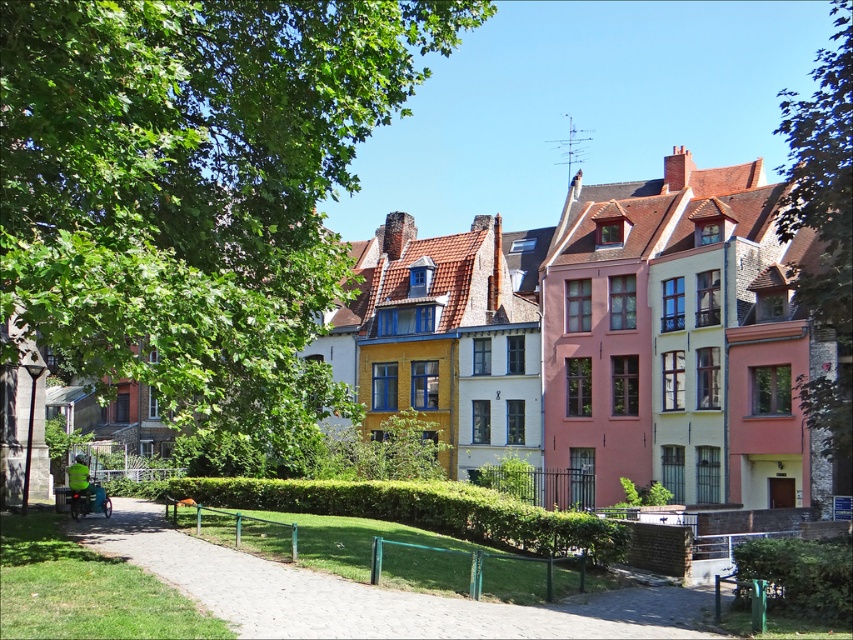
Is green leafy tree at upper left thinner than smooth concrete path at lower left?

No, green leafy tree at upper left is not thinner than smooth concrete path at lower left.

Is point (178, 316) less distant than point (183, 556)?

Yes, it is.

You are a GUI agent. You are given a task and a screenshot of the screen. Output one action in this format:
    pyautogui.click(x=<x>, y=<y>)
    Task: Click on the green leafy tree at upper left
    The height and width of the screenshot is (640, 853).
    Given the screenshot: What is the action you would take?
    pyautogui.click(x=193, y=182)

Can you confirm if green leafy tree at upper left is positioned to the left of green leafy tree at right?

Indeed, green leafy tree at upper left is positioned on the left side of green leafy tree at right.

Where is `green leafy tree at upper left`? green leafy tree at upper left is located at coordinates (193, 182).

Does smooth concrete path at lower left lie in front of green leafy tree at right?

Yes, smooth concrete path at lower left is in front of green leafy tree at right.

This screenshot has width=853, height=640. Find the location of `smooth concrete path at lower left`. smooth concrete path at lower left is located at coordinates (370, 595).